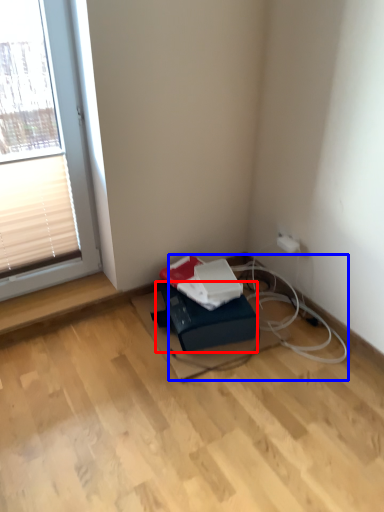
Question: Which object is closer to the camera taking this photo, cardboard box (highlighted by a red box) or cable (highlighted by a blue box)?

Choices:
 (A) cardboard box
 (B) cable

Answer: (B)